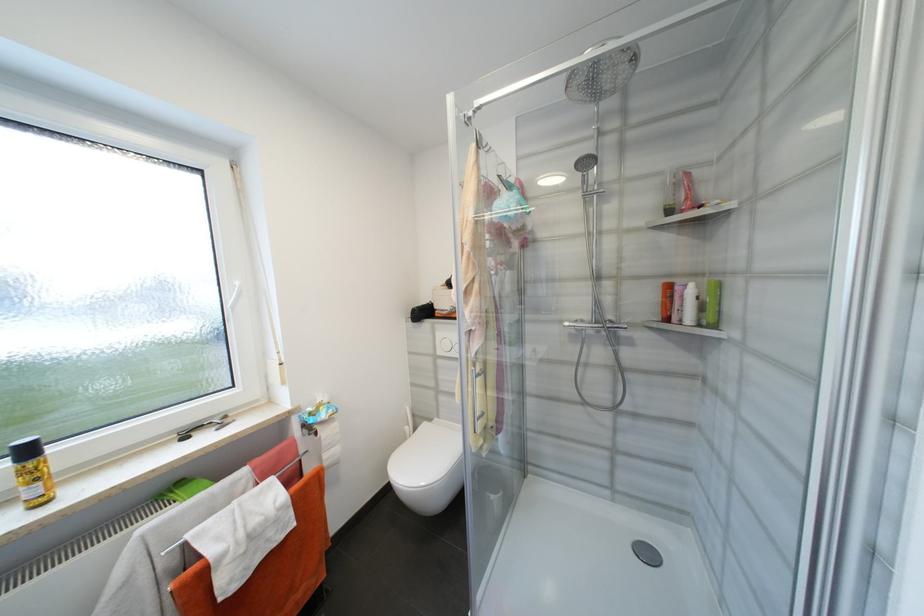
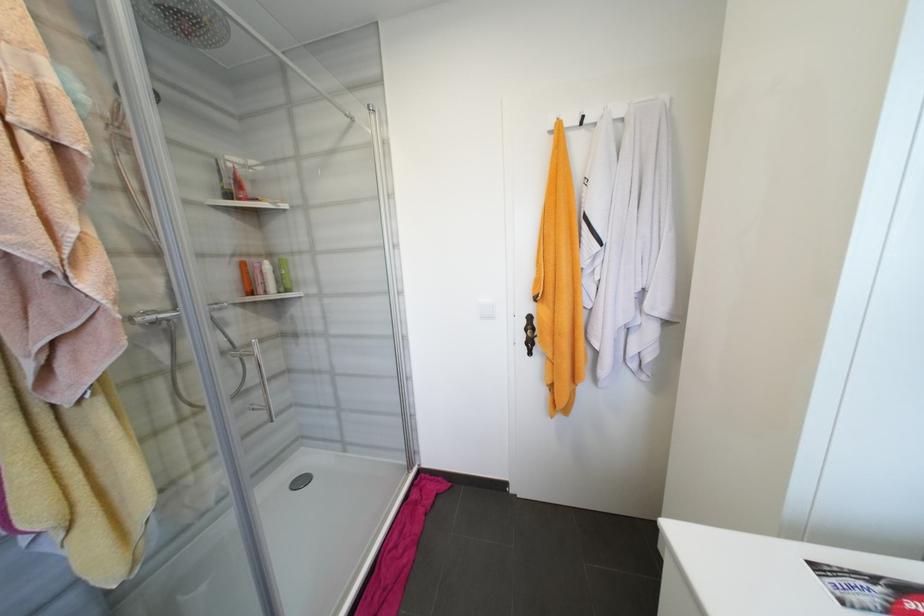
Question: How did the camera likely rotate?

Choices:
 (A) Left
 (B) Right
 (C) Up
 (D) Down

Answer: (B)